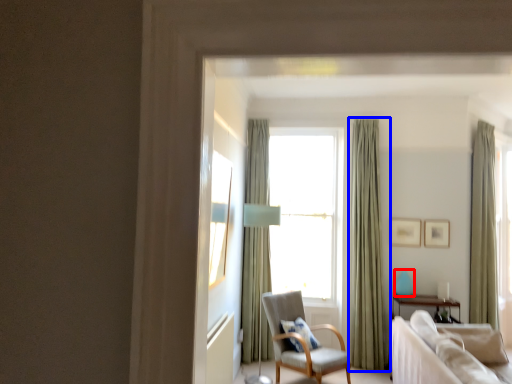
Question: Among these objects, which one is nearest to the camera, teal (highlighted by a red box) or curtain (highlighted by a blue box)?

Choices:
 (A) teal
 (B) curtain

Answer: (B)